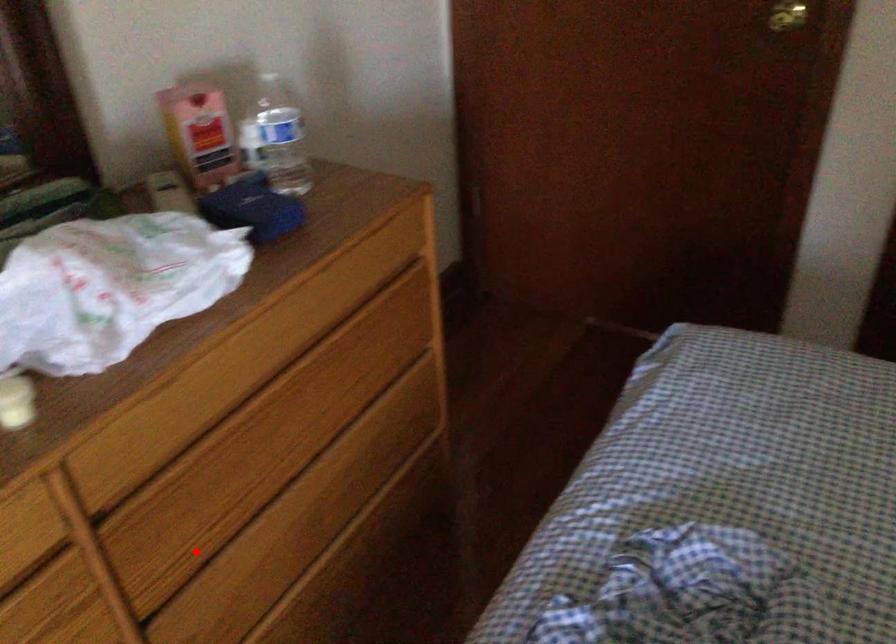
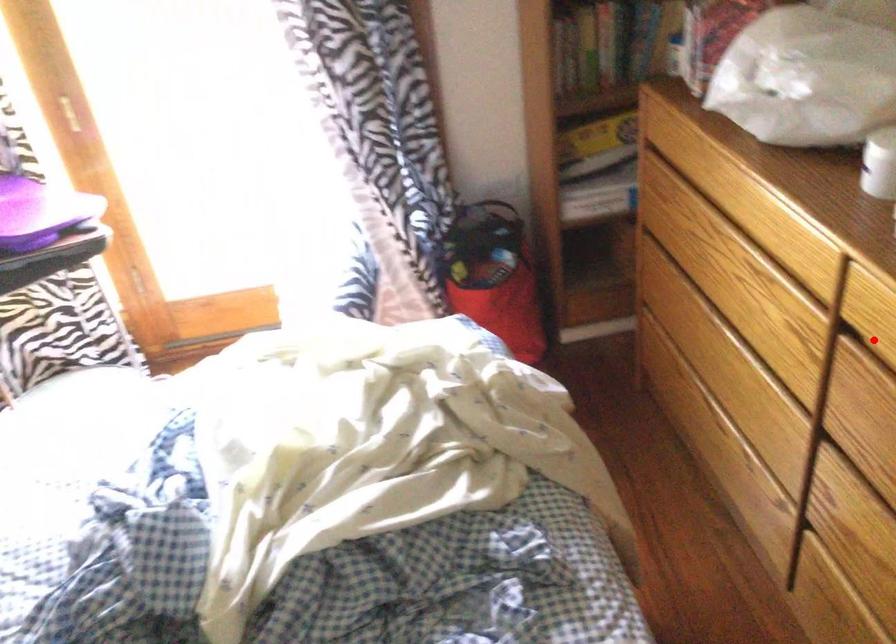
I am providing you with two images of the same scene from different viewpoints. A red point is marked on the first image and another point is marked on the second image. Do the highlighted points in image1 and image2 indicate the same real-world spot?

No